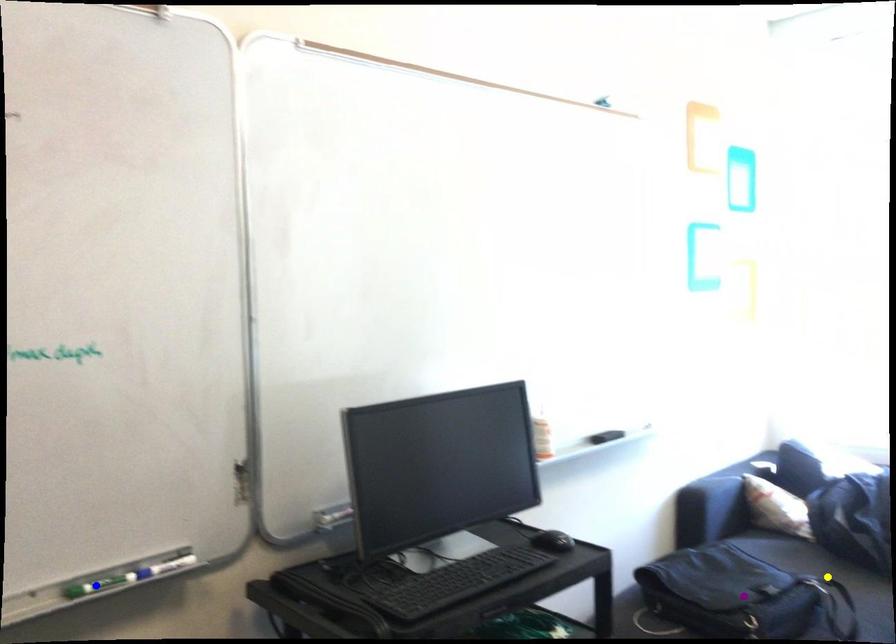
Order these from nearest to farthest:
- purple point
- blue point
- yellow point

blue point, purple point, yellow point